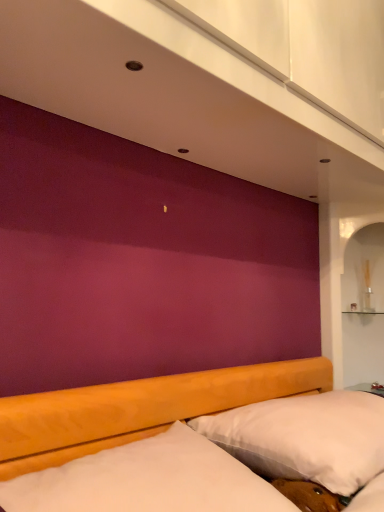
Locate an element on the screen. This screenshot has width=384, height=512. metallic silver table at lower right is located at coordinates (369, 388).

Which of these two, white soft mattress at lower center or white soft pillow at lower right, stands taller?

white soft pillow at lower right is taller.

Is point (10, 489) positioned behind point (255, 436)?

No, (10, 489) is in front of (255, 436).

From the image's perspective, is white soft mattress at lower center over white soft pillow at lower right?

Yes, from the image's perspective, white soft mattress at lower center is on top of white soft pillow at lower right.

Which is more to the left, white soft mattress at lower center or white soft pillow at lower right?

white soft mattress at lower center.

In the scene shown: Is white soft pillow at lower right positioned far away from metallic silver table at lower right?

No, there isn't a large distance between white soft pillow at lower right and metallic silver table at lower right.

Can you confirm if white soft pillow at lower right is bigger than metallic silver table at lower right?

Correct, white soft pillow at lower right is larger in size than metallic silver table at lower right.

Which is nearer, (236, 413) or (369, 388)?

Point (236, 413) is closer to the camera than point (369, 388).

Is point (327, 444) positioned before point (179, 501)?

That is False.

Between white soft pillow at lower right and white soft mattress at lower center, which one appears on the left side from the viewer's perspective?

Positioned to the left is white soft mattress at lower center.

Would you say white soft pillow at lower right is outside white soft mattress at lower center?

Yes, white soft pillow at lower right is outside of white soft mattress at lower center.

Would you consider white soft pillow at lower right to be distant from white soft mattress at lower center?

That's not correct — white soft pillow at lower right is a little close to white soft mattress at lower center.

Can you tell me how much metallic silver table at lower right and white soft pillow at lower right differ in facing direction?

The facing directions of metallic silver table at lower right and white soft pillow at lower right are 1.04 degrees apart.

Which of these two, metallic silver table at lower right or white soft pillow at lower right, is smaller?

With smaller size is metallic silver table at lower right.

From the picture: Is metallic silver table at lower right next to white soft pillow at lower right and touching it?

No, metallic silver table at lower right is not making contact with white soft pillow at lower right.

From a real-world perspective, is metallic silver table at lower right positioned over white soft pillow at lower right based on gravity?

No, from a real-world perspective, metallic silver table at lower right is not above white soft pillow at lower right.

In the image, is metallic silver table at lower right positioned in front of or behind white soft mattress at lower center?

metallic silver table at lower right is positioned farther from the viewer than white soft mattress at lower center.

In the scene shown: From the image's perspective, which is below, metallic silver table at lower right or white soft mattress at lower center?

metallic silver table at lower right, from the image's perspective.

Based on the photo, is the surface of metallic silver table at lower right in direct contact with white soft mattress at lower center?

No, metallic silver table at lower right is not beside white soft mattress at lower center.

Based on the photo, is the depth of white soft mattress at lower center greater than that of metallic silver table at lower right?

No, it is not.

Based on their positions, is white soft mattress at lower center located to the left or right of metallic silver table at lower right?

white soft mattress at lower center is to the left of metallic silver table at lower right.

Find the location of a particular element. mattress in front of the metallic silver table at lower right is located at coordinates (147, 480).

You are a GUI agent. You are given a task and a screenshot of the screen. Output one action in this format:
    pyautogui.click(x=<x>, y=<y>)
    Task: Click on the mattress on the left side of white soft pillow at lower right
    This screenshot has height=512, width=384.
    Given the screenshot: What is the action you would take?
    click(147, 480)

What are the coordinates of `pillow above the metallic silver table at lower right (from the image's perspective)` in the screenshot? It's located at (305, 438).

Based on the photo, looking at the image, which one is located further to white soft pillow at lower right, white soft mattress at lower center or metallic silver table at lower right?

metallic silver table at lower right lies further to white soft pillow at lower right than the other object.

Based on their spatial positions, is white soft pillow at lower right or white soft mattress at lower center further from metallic silver table at lower right?

The object further to metallic silver table at lower right is white soft mattress at lower center.

Looking at the image, which one is located further to white soft mattress at lower center, metallic silver table at lower right or white soft pillow at lower right?

Based on the image, metallic silver table at lower right appears to be further to white soft mattress at lower center.

Estimate the real-world distances between objects in this image. Which object is further from white soft mattress at lower center, white soft pillow at lower right or metallic silver table at lower right?

metallic silver table at lower right.

Looking at this image, looking at the image, which one is located further to white soft pillow at lower right, metallic silver table at lower right or white soft mattress at lower center?

Based on the image, metallic silver table at lower right appears to be further to white soft pillow at lower right.

Based on their spatial positions, is white soft mattress at lower center or white soft pillow at lower right closer to metallic silver table at lower right?

white soft pillow at lower right is positioned closer to the anchor metallic silver table at lower right.

The image size is (384, 512). What are the coordinates of `pillow between white soft mattress at lower center and metallic silver table at lower right along the z-axis` in the screenshot? It's located at (305, 438).